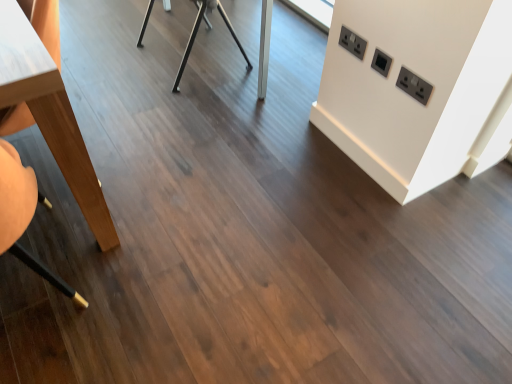
Question: From the image's perspective, is light brown wood table at left, which appears as the 2th table when viewed from the right, under wooden swivel chair at left?

Choices:
 (A) yes
 (B) no

Answer: (B)

Question: Does light brown wood table at left, which appears as the 2th table when viewed from the right, have a lesser width compared to wooden swivel chair at left?

Choices:
 (A) yes
 (B) no

Answer: (A)

Question: Can you confirm if light brown wood table at left, placed as the first table when sorted from left to right, is taller than wooden swivel chair at left?

Choices:
 (A) yes
 (B) no

Answer: (B)

Question: Does light brown wood table at left, placed as the first table when sorted from left to right, touch wooden swivel chair at left?

Choices:
 (A) no
 (B) yes

Answer: (A)

Question: Is light brown wood table at left, the 2th table viewed from the back, positioned with its back to wooden swivel chair at left?

Choices:
 (A) yes
 (B) no

Answer: (B)

Question: From a real-world perspective, is light brown wood table at left, the 2th table viewed from the back, physically above wooden swivel chair at left?

Choices:
 (A) yes
 (B) no

Answer: (B)

Question: Is black plastic/socket at upper right, which is the third electric outlet in bottom-to-top order, positioned behind metallic silver table at center, which is the 2th table from left to right?

Choices:
 (A) yes
 (B) no

Answer: (B)

Question: Can metallic silver table at center, the first table viewed from the right, be found inside black plastic/socket at upper right, which is the 1th electric outlet in left-to-right order?

Choices:
 (A) yes
 (B) no

Answer: (B)

Question: Does black plastic/socket at upper right, which ranks as the first electric outlet in top-to-bottom order, have a lesser height compared to metallic silver table at center, placed as the 1th table when sorted from back to front?

Choices:
 (A) no
 (B) yes

Answer: (B)

Question: Considering the relative positions of black plastic/socket at upper right, which ranks as the first electric outlet in top-to-bottom order, and metallic silver table at center, the first table viewed from the right, in the image provided, is black plastic/socket at upper right, which ranks as the first electric outlet in top-to-bottom order, to the right of metallic silver table at center, the first table viewed from the right, from the viewer's perspective?

Choices:
 (A) yes
 (B) no

Answer: (A)

Question: Is black plastic/socket at upper right, which is the third electric outlet in bottom-to-top order, wider than metallic silver table at center, the 2th table positioned from the front?

Choices:
 (A) no
 (B) yes

Answer: (A)

Question: From the image's perspective, is black plastic/socket at upper right, positioned as the 3th electric outlet in right-to-left order, beneath metallic silver table at center, the 2th table positioned from the front?

Choices:
 (A) no
 (B) yes

Answer: (B)

Question: Is black plastic electric outlet at upper right, which is the 3th electric outlet from top to bottom, beside black plastic electric outlet at upper right, the 2th electric outlet ordered from the bottom?

Choices:
 (A) yes
 (B) no

Answer: (B)